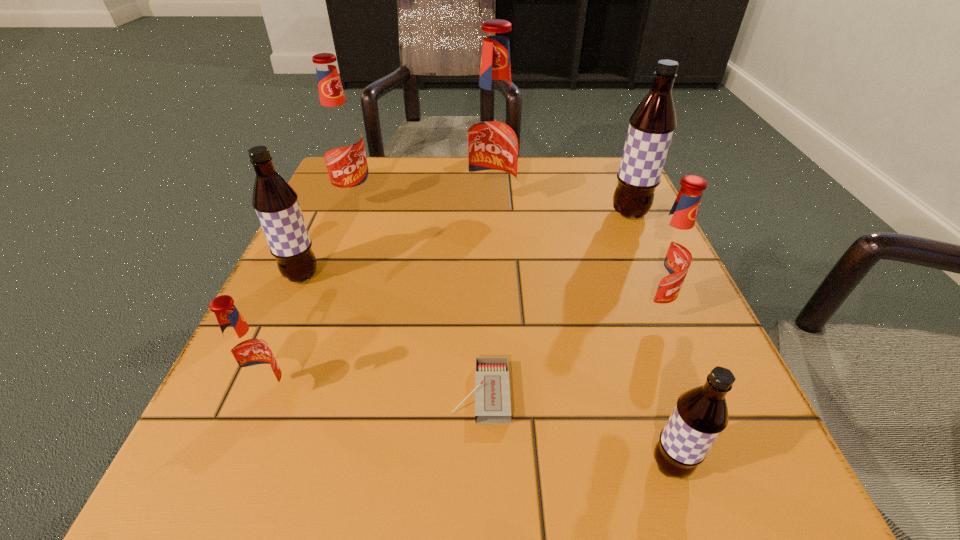
In the image, there is a desktop. Where is `vacant space at the near edge`? The width and height of the screenshot is (960, 540). vacant space at the near edge is located at coordinates (634, 504).

In the image, there is a desktop. At what (x,y) coordinates should I click in order to perform the action: click on vacant space at the left edge. Please return your answer as a coordinate pair (x, y). Looking at the image, I should click on (349, 222).

This screenshot has width=960, height=540. Identify the location of free location at the right edge of the desktop. (605, 315).

Locate an element on the screen. vacant space at the far left corner is located at coordinates (376, 159).

The width and height of the screenshot is (960, 540). Identify the location of vacant area at the near left corner. (268, 496).

This screenshot has width=960, height=540. I want to click on free location at the far right corner of the desktop, so click(563, 161).

The width and height of the screenshot is (960, 540). In order to click on vacant region at the near right corner of the desktop in this screenshot , I will do `click(642, 455)`.

At what (x,y) coordinates should I click in order to perform the action: click on vacant space in between the fourth farthest root beer and the nearest red root beer. Please return your answer as a coordinate pair (x, y). Looking at the image, I should click on tap(286, 335).

Locate an element on the screen. The image size is (960, 540). vacant area between the second biggest red root beer and the white matchbox is located at coordinates (418, 298).

At what (x,y) coordinates should I click in order to perform the action: click on free area in between the leftmost brown root beer and the white matchbox. Please return your answer as a coordinate pair (x, y). Looking at the image, I should click on (392, 334).